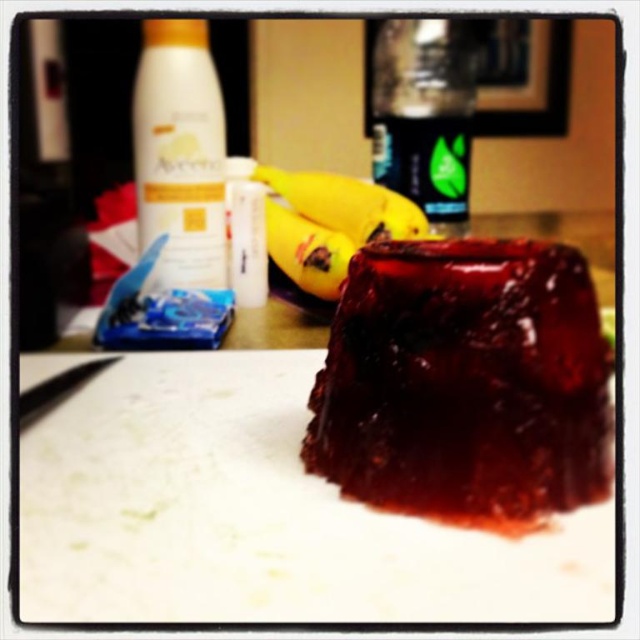
Question: Is white matte lotion at upper left above yellow rubbery banana at center?

Choices:
 (A) no
 (B) yes

Answer: (B)

Question: Is white matte lotion at upper left above yellow rubbery banana at center?

Choices:
 (A) yes
 (B) no

Answer: (A)

Question: Which of the following is the farthest from the observer?

Choices:
 (A) (429, 33)
 (B) (384, 246)
 (C) (202, 32)
 (D) (273, 236)

Answer: (D)

Question: Which object is closer to the camera taking this photo?

Choices:
 (A) shiny dark red jelly at center
 (B) white matte lotion at upper left
 (C) translucent plastic bottle at upper center
 (D) yellow rubbery banana at center

Answer: (A)

Question: Which of the following is the farthest from the observer?

Choices:
 (A) yellow rubbery banana at center
 (B) white matte lotion at upper left
 (C) shiny dark red jelly at center
 (D) translucent plastic bottle at upper center

Answer: (D)

Question: Can you confirm if yellow smooth banana at center is thinner than yellow rubbery banana at center?

Choices:
 (A) yes
 (B) no

Answer: (B)